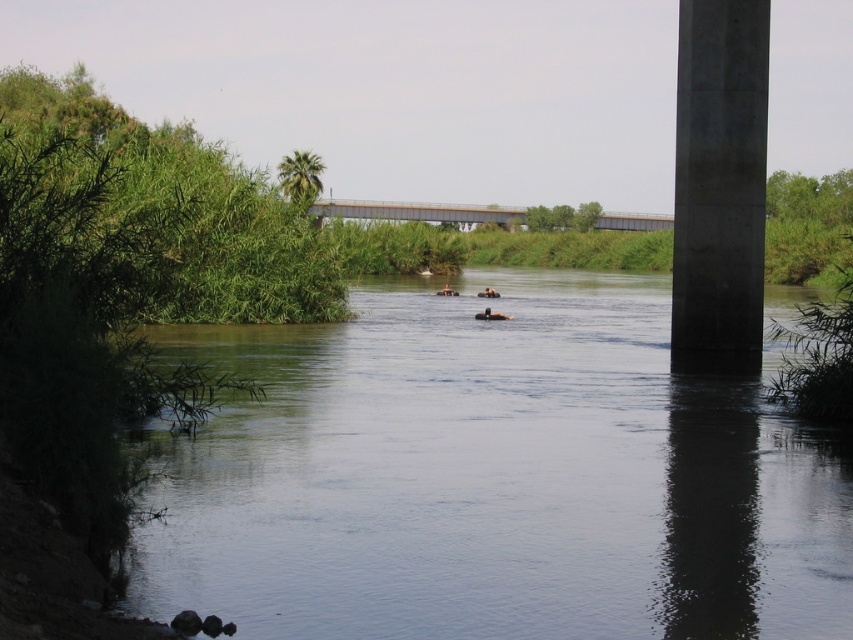
Question: Which of the following is the closest to the observer?

Choices:
 (A) brown rubber tube at center
 (B) metal/textured bridge at upper center
 (C) clear water at center
 (D) concrete at right

Answer: (C)

Question: Which of the following is the farthest from the observer?

Choices:
 (A) (x=486, y=298)
 (B) (x=747, y=252)

Answer: (A)

Question: Which point is closer to the camera?

Choices:
 (A) metal/textured bridge at upper center
 (B) brown rubber tube at center
 (C) clear water at center

Answer: (C)

Question: Is metal/textured bridge at upper center below brown rubber tube at center?

Choices:
 (A) no
 (B) yes

Answer: (A)

Question: Can you confirm if metal/textured bridge at upper center is smaller than brown rubber ring at center?

Choices:
 (A) yes
 (B) no

Answer: (B)

Question: Is concrete at right bigger than brown rubber ring at center?

Choices:
 (A) yes
 (B) no

Answer: (A)